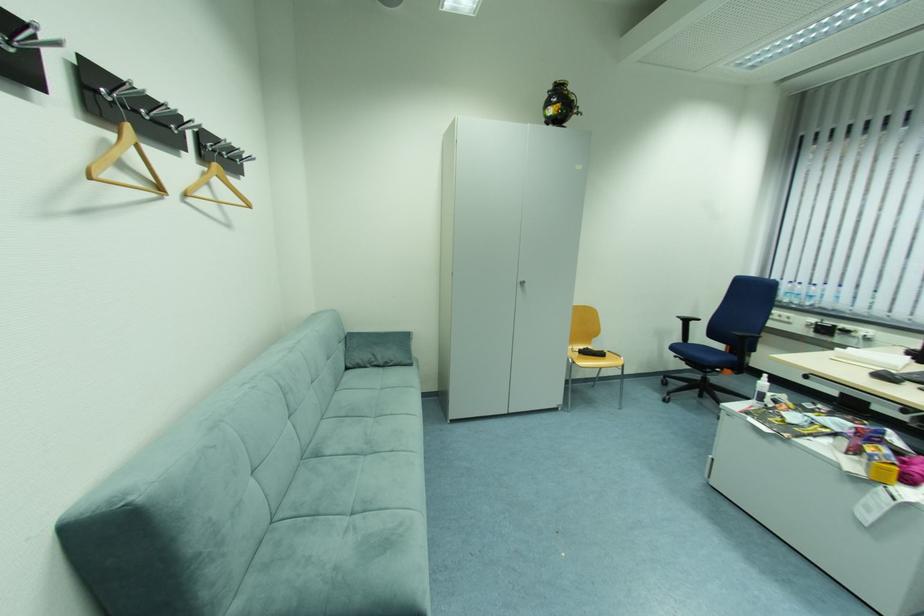
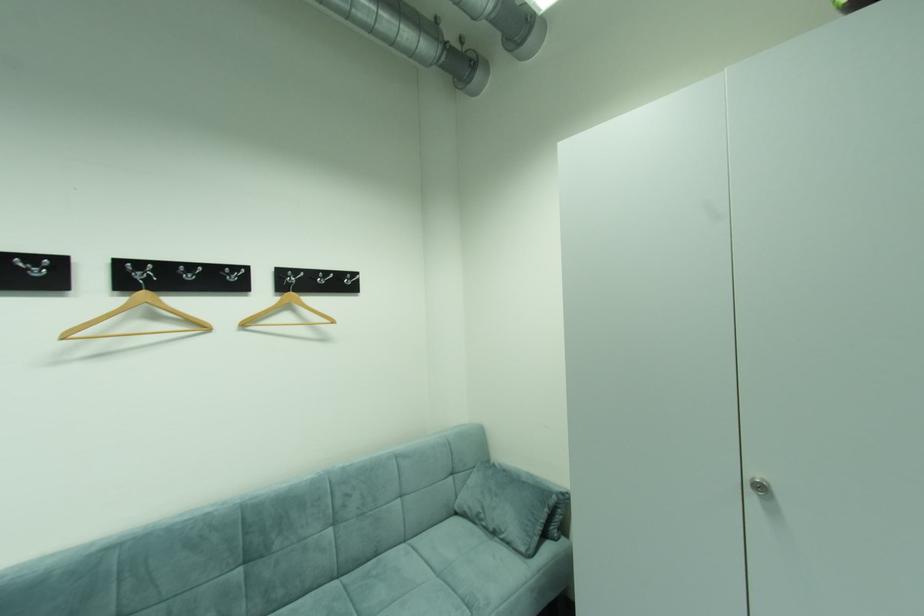
Locate, in the second image, the point that corresponds to pixel 354 370 in the first image.

(464, 514)